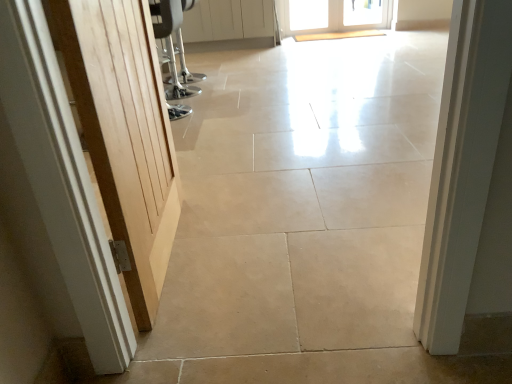
Locate an element on the screen. This screenshot has width=512, height=384. vacant space behind light wood door at left, which is the 3th door in back-to-front order is located at coordinates (218, 189).